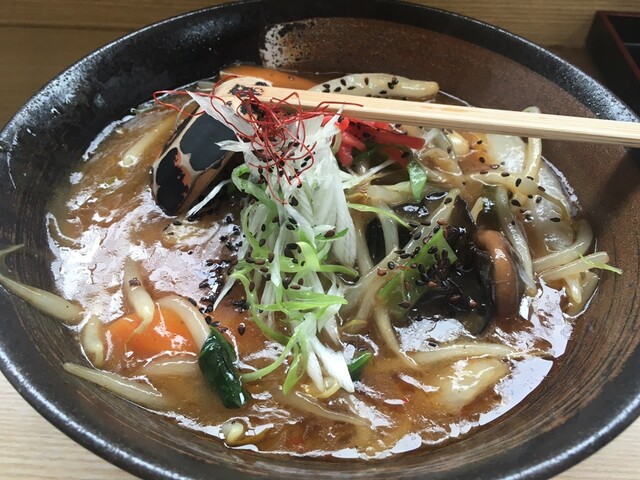
This screenshot has width=640, height=480. Identify the location of chop stick. (522, 125).